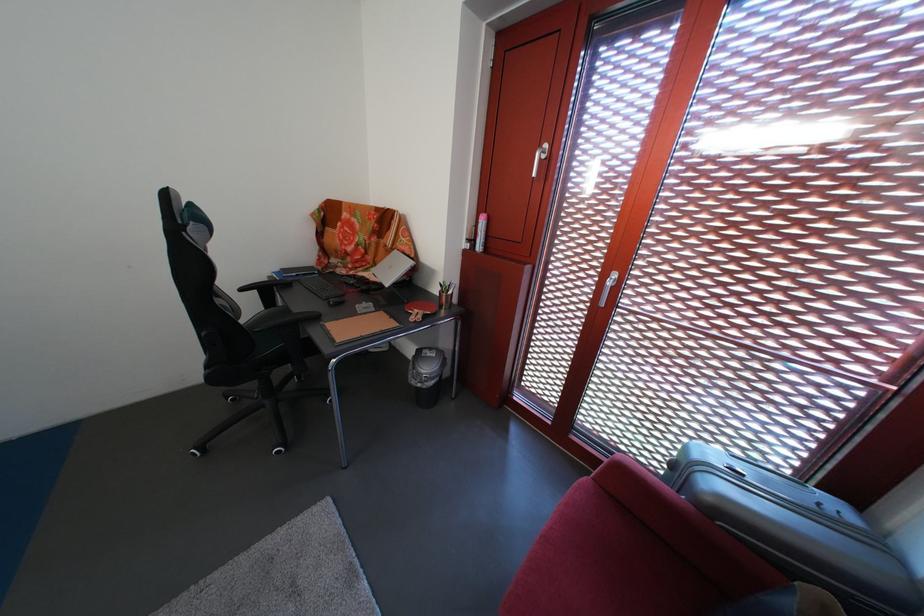
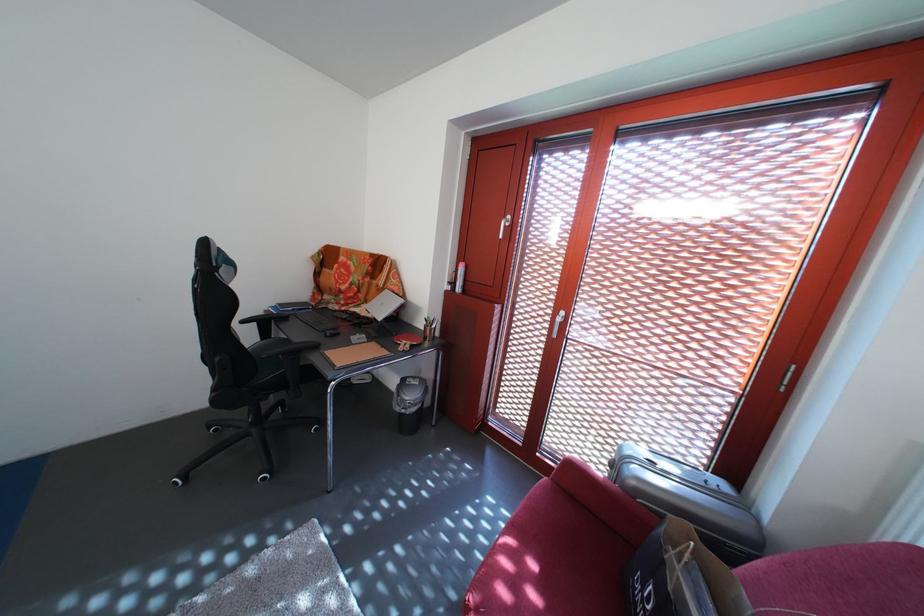
Question: Which direction would the cameraman need to move to produce the second image? Reply with the corresponding letter.

Choices:
 (A) Left
 (B) Right
 (C) Forward
 (D) Backward

Answer: (D)